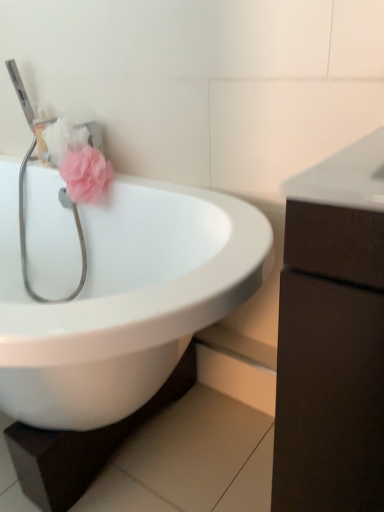
Question: Is pink fabric flower at upper left with dark brown wood cabinet at right?

Choices:
 (A) yes
 (B) no

Answer: (B)

Question: Can you confirm if pink fabric flower at upper left is positioned to the left of dark brown wood cabinet at right?

Choices:
 (A) no
 (B) yes

Answer: (B)

Question: From a real-world perspective, is pink fabric flower at upper left located higher than dark brown wood cabinet at right?

Choices:
 (A) no
 (B) yes

Answer: (B)

Question: Would you say pink fabric flower at upper left is a long distance from dark brown wood cabinet at right?

Choices:
 (A) no
 (B) yes

Answer: (A)

Question: From the image's perspective, is pink fabric flower at upper left over dark brown wood cabinet at right?

Choices:
 (A) yes
 (B) no

Answer: (A)

Question: Is pink fabric flower at upper left closer to camera compared to dark brown wood cabinet at right?

Choices:
 (A) no
 (B) yes

Answer: (A)

Question: Are metallic silver stethoscope at left and white glossy sink at center located far from each other?

Choices:
 (A) no
 (B) yes

Answer: (A)

Question: From the image's perspective, would you say metallic silver stethoscope at left is shown under white glossy sink at center?

Choices:
 (A) no
 (B) yes

Answer: (A)

Question: Is white glossy sink at center at the back of metallic silver stethoscope at left?

Choices:
 (A) yes
 (B) no

Answer: (A)

Question: Does metallic silver stethoscope at left appear on the left side of white glossy sink at center?

Choices:
 (A) no
 (B) yes

Answer: (A)

Question: From a real-world perspective, is metallic silver stethoscope at left located higher than white glossy sink at center?

Choices:
 (A) yes
 (B) no

Answer: (A)

Question: Can you confirm if metallic silver stethoscope at left is taller than white glossy sink at center?

Choices:
 (A) no
 (B) yes

Answer: (A)

Question: Is white glossy sink at center positioned in front of dark brown wood cabinet at right?

Choices:
 (A) yes
 (B) no

Answer: (B)